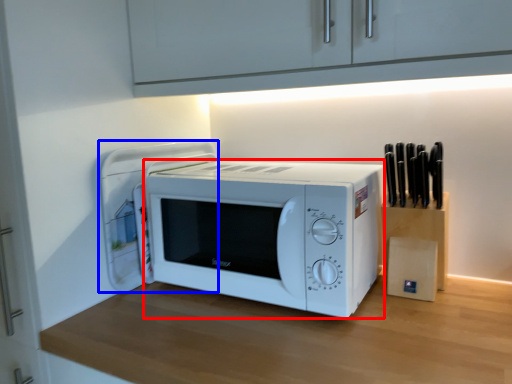
Question: Among these objects, which one is nearest to the camera, microwave oven (highlighted by a red box) or appliance (highlighted by a blue box)?

Choices:
 (A) microwave oven
 (B) appliance

Answer: (A)